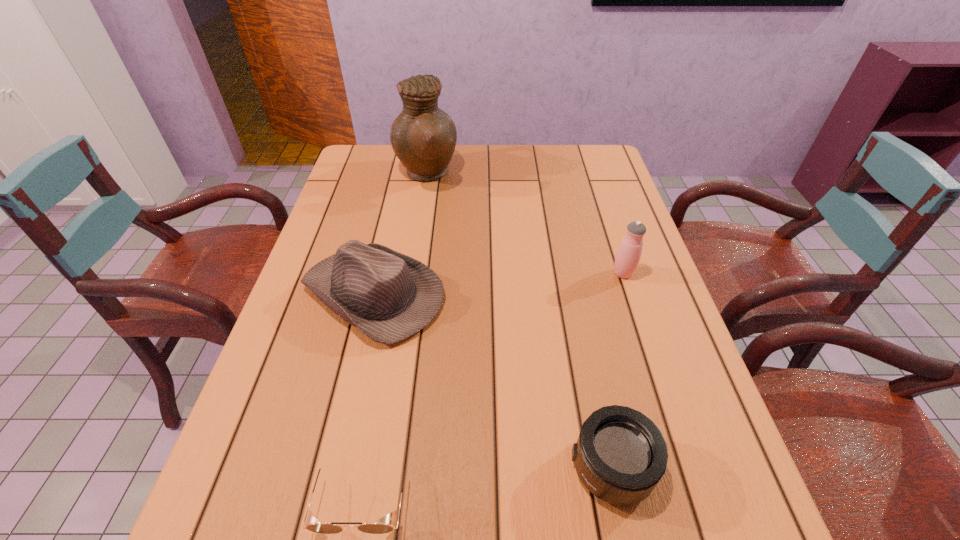
The height and width of the screenshot is (540, 960). I want to click on vacant space situated on the right of the third tallest object, so click(x=545, y=294).

The width and height of the screenshot is (960, 540). Find the location of `vacant space situated on the side of the fourth tallest object with brand markings and control switches`. vacant space situated on the side of the fourth tallest object with brand markings and control switches is located at coordinates (426, 467).

The width and height of the screenshot is (960, 540). I want to click on free space located on the side of the fourth tallest object with brand markings and control switches, so click(420, 467).

Find the location of `free space located 0.130m on the side of the fourth tallest object with brand markings and control switches`. free space located 0.130m on the side of the fourth tallest object with brand markings and control switches is located at coordinates (495, 467).

Locate an element on the screen. object present at the far edge is located at coordinates (423, 137).

Identify the location of object that is at the near edge. Image resolution: width=960 pixels, height=540 pixels. (312, 524).

The image size is (960, 540). What are the coordinates of `pitcher present at the left edge` in the screenshot? It's located at (423, 137).

I want to click on fedora that is at the left edge, so click(389, 296).

In order to click on thermos bottle at the right edge in this screenshot , I will do `click(628, 255)`.

Where is `telephoto lens that is at the right edge`? Image resolution: width=960 pixels, height=540 pixels. telephoto lens that is at the right edge is located at coordinates 620,456.